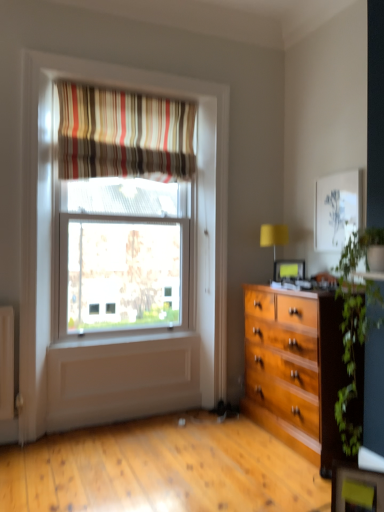
Question: From the image's perspective, is green leafy plant at right positioned above or below matte black picture frame at center?

Choices:
 (A) below
 (B) above

Answer: (A)

Question: Is green leafy plant at right to the left or to the right of matte black picture frame at center in the image?

Choices:
 (A) right
 (B) left

Answer: (A)

Question: Which object is the farthest from the matte black picture frame at center?

Choices:
 (A) striped fabric curtain at upper center
 (B) green leafy plant at right
 (C) yellow fabric lampshade at right

Answer: (A)

Question: Considering the real-world distances, which object is closest to the green leafy plant at right?

Choices:
 (A) matte black picture frame at center
 (B) yellow fabric lampshade at right
 (C) striped fabric curtain at upper center

Answer: (A)